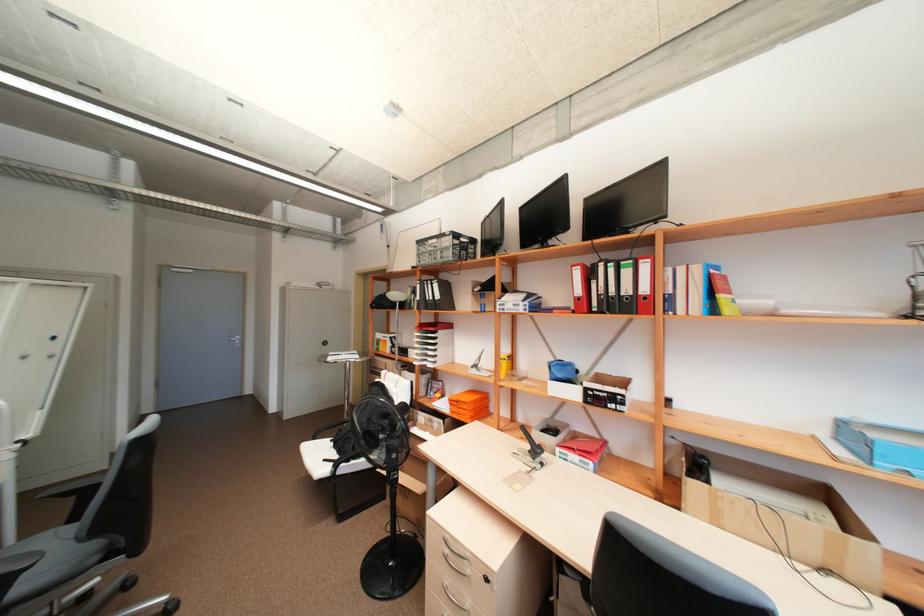
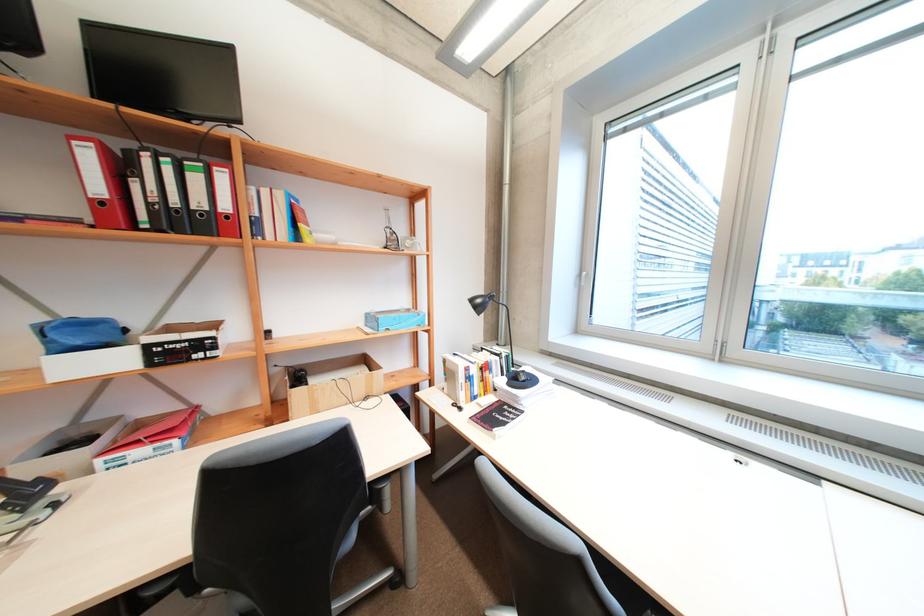
Question: The camera is either moving clockwise (left) or counter-clockwise (right) around the object. The first image is from the beginning of the video and the second image is from the end. Is the camera moving left or right when shooting the video?

Choices:
 (A) Left
 (B) Right

Answer: (A)